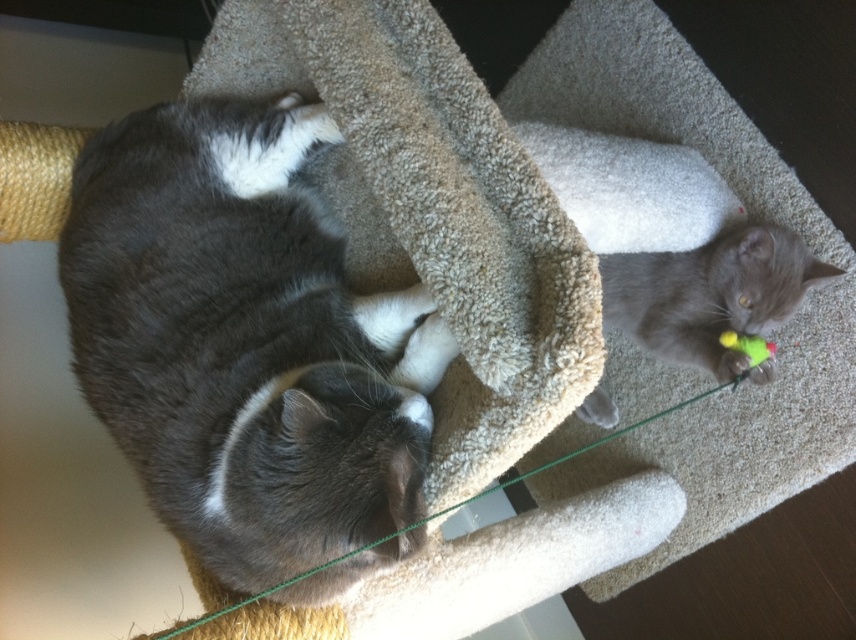
Does green string at center appear on the right side of green fuzzy toy at right?

Incorrect, green string at center is not on the right side of green fuzzy toy at right.

Measure the distance between green string at center and green fuzzy toy at right.

green string at center and green fuzzy toy at right are 52.74 centimeters apart.

Does point (181, 630) come closer to viewer compared to point (749, 356)?

Yes, it is.

Where is `green string at center`? The image size is (856, 640). green string at center is located at coordinates (586, 448).

Is gray soft toy at right wider than green fuzzy toy at right?

Correct, the width of gray soft toy at right exceeds that of green fuzzy toy at right.

Which is more to the right, gray soft toy at right or green fuzzy toy at right?

green fuzzy toy at right

The height and width of the screenshot is (640, 856). What do you see at coordinates (711, 296) in the screenshot?
I see `gray soft toy at right` at bounding box center [711, 296].

The image size is (856, 640). Find the location of `gray soft toy at right`. gray soft toy at right is located at coordinates (711, 296).

Does point (103, 284) come closer to viewer compared to point (758, 344)?

Yes, point (103, 284) is closer to viewer.

Can you confirm if gray fluffy cat at left is thinner than green fuzzy toy at right?

No, gray fluffy cat at left is not thinner than green fuzzy toy at right.

Which is behind, point (253, 177) or point (755, 356)?

The point (755, 356) is more distant.

The height and width of the screenshot is (640, 856). Identify the location of gray fluffy cat at left. (242, 340).